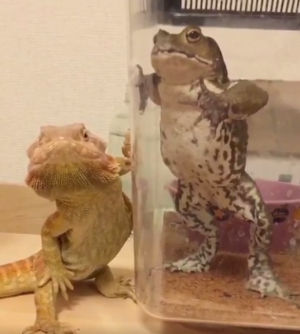
Identify the location of frog tank. The image size is (300, 334). tap(235, 29).